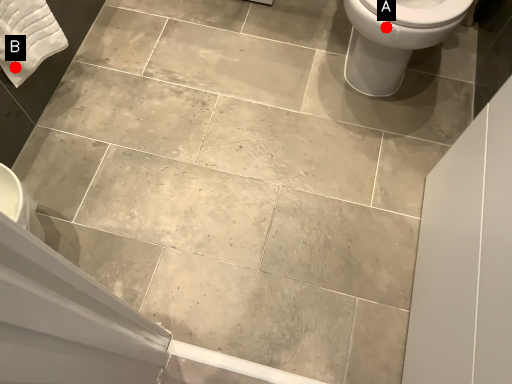
Question: Two points are circled on the image, labeled by A and B beside each circle. Which point is closer to the camera?

Choices:
 (A) A is closer
 (B) B is closer

Answer: (A)